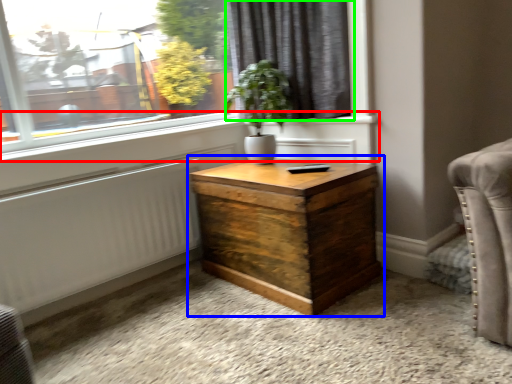
Question: Which object is positioned farthest from window sill (highlighted by a red box)? Select from nightstand (highlighted by a blue box) and curtain (highlighted by a green box).

Choices:
 (A) nightstand
 (B) curtain

Answer: (A)